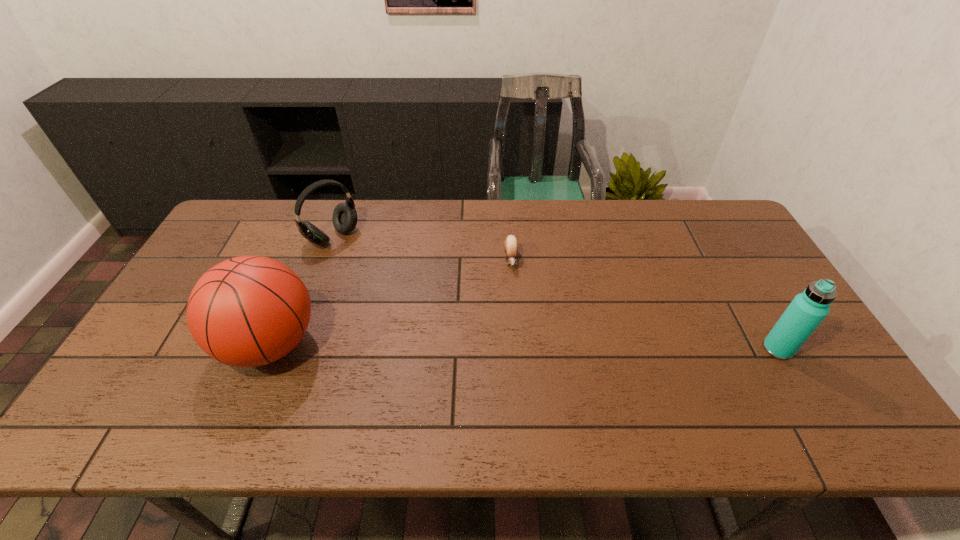
Where is `vacant space on the desktop that is between the basketball and the rightmost object and is positioned on the ear cups of the second shortest object`? This screenshot has height=540, width=960. vacant space on the desktop that is between the basketball and the rightmost object and is positioned on the ear cups of the second shortest object is located at coordinates (462, 346).

Image resolution: width=960 pixels, height=540 pixels. I want to click on free space on the desktop that is between the basketball and the water bottle and is positioned on the front-facing side of the shortest object, so click(x=517, y=347).